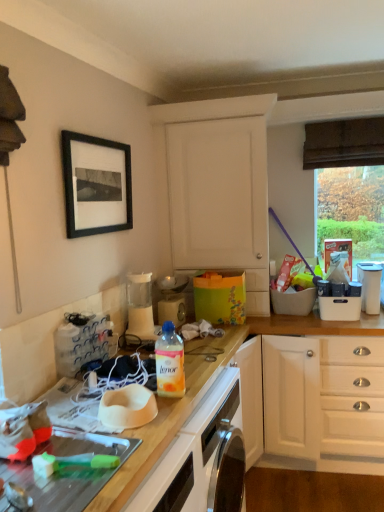
From the picture: In order to face white glossy oven at lower center, should I rotate leftwards or rightwards?

To face it directly, rotate left by 3.763 degrees.

Where is `black matte picture frame at upper left`? This screenshot has width=384, height=512. black matte picture frame at upper left is located at coordinates (96, 184).

In order to face black matte picture frame at upper left, should I rotate leftwards or rightwards?

You should rotate left by 11.699 degrees.

In order to face white plastic container at upper right, the 1th appliance when ordered from right to left, should I rotate leftwards or rightwards?

A 22.917 degree turn to the right will do.

What do you see at coordinates (217, 187) in the screenshot? I see `white matte cabinet at upper center` at bounding box center [217, 187].

This screenshot has width=384, height=512. In order to click on matte plastic blender at center, the 1th appliance positioned from the left in this screenshot , I will do `click(172, 298)`.

In the scene shown: From the image's perspective, between translucent plastic bottle at center and white glossy oven at lower center, which one is located above?

translucent plastic bottle at center appears higher in the image.

Is translucent plastic bottle at center in contact with white glossy oven at lower center?

No, translucent plastic bottle at center is not in contact with white glossy oven at lower center.

Considering the relative sizes of translucent plastic bottle at center and white glossy oven at lower center in the image provided, is translucent plastic bottle at center smaller than white glossy oven at lower center?

Correct, translucent plastic bottle at center occupies less space than white glossy oven at lower center.

Would you say translucent plastic bottle at center is to the left or to the right of white glossy oven at lower center in the picture?

In the image, translucent plastic bottle at center appears on the right side of white glossy oven at lower center.

Is white matte cabinet at upper center aimed at matte plastic blender at center, the 1th appliance positioned from the left?

Yes, white matte cabinet at upper center is aimed at matte plastic blender at center, the 1th appliance positioned from the left.

Considering the sizes of objects white matte cabinet at upper center and matte plastic blender at center, the 1th appliance positioned from the left, in the image provided, who is taller, white matte cabinet at upper center or matte plastic blender at center, the 1th appliance positioned from the left,?

white matte cabinet at upper center.

Would you say white matte cabinet at upper center is to the left or to the right of matte plastic blender at center, which is the second appliance from right to left, in the picture?

From the image, it's evident that white matte cabinet at upper center is to the right of matte plastic blender at center, which is the second appliance from right to left.

Measure the distance from white matte cabinet at upper center to matte plastic blender at center, the 1th appliance positioned from the left.

A distance of 21.78 inches exists between white matte cabinet at upper center and matte plastic blender at center, the 1th appliance positioned from the left.

Is white plastic container at upper right, acting as the second appliance starting from the left, touching black matte picture frame at upper left?

They are not placed beside each other.

From a real-world perspective, is white plastic container at upper right, the 1th appliance when ordered from right to left, above or below black matte picture frame at upper left?

In terms of real-world spatial position, white plastic container at upper right, the 1th appliance when ordered from right to left, is below black matte picture frame at upper left.

From a real-world perspective, starting from the black matte picture frame at upper left, which appliance is the 1st one below it? Please provide its 2D coordinates.

[(370, 286)]

Between white plastic container at upper right, acting as the second appliance starting from the left, and black matte picture frame at upper left, which one has less height?

white plastic container at upper right, acting as the second appliance starting from the left, is shorter.

Which of these two, black matte picture frame at upper left or white glossy oven at lower center, is bigger?

white glossy oven at lower center.

Between black matte picture frame at upper left and white glossy oven at lower center, which one appears on the left side from the viewer's perspective?

black matte picture frame at upper left.

From the picture: Which object is closer to the camera, black matte picture frame at upper left or white glossy oven at lower center?

white glossy oven at lower center is more forward.

Is black matte picture frame at upper left located outside white glossy oven at lower center?

Indeed, black matte picture frame at upper left is completely outside white glossy oven at lower center.

Between matte plastic blender at center, which is the second appliance from right to left, and white glossy oven at lower center, which one appears on the left side from the viewer's perspective?

white glossy oven at lower center.

Considering the positions of points (161, 302) and (157, 481), is point (161, 302) farther from camera compared to point (157, 481)?

Yes.

From a real-world perspective, which is physically below, matte plastic blender at center, the 1th appliance positioned from the left, or white glossy oven at lower center?

From a 3D spatial view, white glossy oven at lower center is below.

There is a white glossy oven at lower center. In order to click on the 1st appliance above it (from the image's perspective) in this screenshot , I will do `click(172, 298)`.

Can you confirm if black matte picture frame at upper left is wider than matte plastic blender at center, the 1th appliance positioned from the left?

In fact, black matte picture frame at upper left might be narrower than matte plastic blender at center, the 1th appliance positioned from the left.

Does black matte picture frame at upper left have a smaller size compared to matte plastic blender at center, which is the second appliance from right to left?

No.

Which appliance is the 1st one when counting from the right side of the black matte picture frame at upper left? Please provide its 2D coordinates.

[(172, 298)]

From the image's perspective, is black matte picture frame at upper left over matte plastic blender at center, the 1th appliance positioned from the left?

Yes, from the image's perspective, black matte picture frame at upper left is on top of matte plastic blender at center, the 1th appliance positioned from the left.

Considering the relative sizes of white plastic container at upper right, acting as the second appliance starting from the left, and matte plastic blender at center, the 1th appliance positioned from the left, in the image provided, is white plastic container at upper right, acting as the second appliance starting from the left, smaller than matte plastic blender at center, the 1th appliance positioned from the left,?

Yes, white plastic container at upper right, acting as the second appliance starting from the left, is smaller than matte plastic blender at center, the 1th appliance positioned from the left.

From the image's perspective, between white plastic container at upper right, the 1th appliance when ordered from right to left, and matte plastic blender at center, the 1th appliance positioned from the left, who is located below?

matte plastic blender at center, the 1th appliance positioned from the left.

Considering the sizes of objects white plastic container at upper right, acting as the second appliance starting from the left, and matte plastic blender at center, the 1th appliance positioned from the left, in the image provided, who is thinner, white plastic container at upper right, acting as the second appliance starting from the left, or matte plastic blender at center, the 1th appliance positioned from the left,?

Thinner between the two is matte plastic blender at center, the 1th appliance positioned from the left.

Does white plastic container at upper right, acting as the second appliance starting from the left, appear on the right side of matte plastic blender at center, the 1th appliance positioned from the left?

Indeed, white plastic container at upper right, acting as the second appliance starting from the left, is positioned on the right side of matte plastic blender at center, the 1th appliance positioned from the left.

At what (x,y) coordinates should I click in order to perform the action: click on bottle above the white glossy oven at lower center (from the image's perspective). Please return your answer as a coordinate pair (x, y). This screenshot has width=384, height=512. Looking at the image, I should click on (170, 362).

This screenshot has height=512, width=384. What are the coordinates of `cabinetry that is on the right side of matte plastic blender at center, which is the second appliance from right to left` in the screenshot? It's located at (217, 187).

Which object lies nearer to the anchor point white glossy oven at lower center, black matte picture frame at upper left or matte plastic blender at center, which is the second appliance from right to left?

matte plastic blender at center, which is the second appliance from right to left.

Looking at this image, which object lies nearer to the anchor point black matte picture frame at upper left, white plastic container at upper right, the 1th appliance when ordered from right to left, or matte plastic blender at center, which is the second appliance from right to left?

matte plastic blender at center, which is the second appliance from right to left.

When comparing their distances from white glossy oven at lower center, does translucent plastic bottle at center or matte plastic blender at center, which is the second appliance from right to left, seem closer?

translucent plastic bottle at center is closer to white glossy oven at lower center.

Estimate the real-world distances between objects in this image. Which object is closer to matte plastic blender at center, the 1th appliance positioned from the left, white matte cabinet at upper center or translucent plastic bottle at center?

Based on the image, white matte cabinet at upper center appears to be nearer to matte plastic blender at center, the 1th appliance positioned from the left.

Which object lies nearer to the anchor point white glossy oven at lower center, white plastic container at upper right, the 1th appliance when ordered from right to left, or black matte picture frame at upper left?

The object closer to white glossy oven at lower center is black matte picture frame at upper left.

Which object lies further to the anchor point translucent plastic bottle at center, white glossy oven at lower center or black matte picture frame at upper left?

Among the two, black matte picture frame at upper left is located further to translucent plastic bottle at center.

From the image, which object appears to be farther from black matte picture frame at upper left, white plastic container at upper right, the 1th appliance when ordered from right to left, or white glossy oven at lower center?

white plastic container at upper right, the 1th appliance when ordered from right to left, lies further to black matte picture frame at upper left than the other object.

Considering their positions, is matte plastic blender at center, the 1th appliance positioned from the left, positioned closer to white plastic container at upper right, acting as the second appliance starting from the left, than translucent plastic bottle at center?

matte plastic blender at center, the 1th appliance positioned from the left, lies closer to white plastic container at upper right, acting as the second appliance starting from the left, than the other object.

Identify the location of oven situated between black matte picture frame at upper left and white plastic container at upper right, the 1th appliance when ordered from right to left, from left to right. (192, 452).

You are a GUI agent. You are given a task and a screenshot of the screen. Output one action in this format:
    pyautogui.click(x=<x>, y=<y>)
    Task: Click on the bottle between white glossy oven at lower center and matte plastic blender at center, which is the second appliance from right to left, from front to back
    The height and width of the screenshot is (512, 384).
    Given the screenshot: What is the action you would take?
    pyautogui.click(x=170, y=362)

This screenshot has width=384, height=512. Identify the location of cabinetry between black matte picture frame at upper left and matte plastic blender at center, which is the second appliance from right to left, in the up-down direction. (217, 187).

The height and width of the screenshot is (512, 384). What are the coordinates of `bottle between white glossy oven at lower center and white plastic container at upper right, acting as the second appliance starting from the left, in the horizontal direction` in the screenshot? It's located at (170, 362).